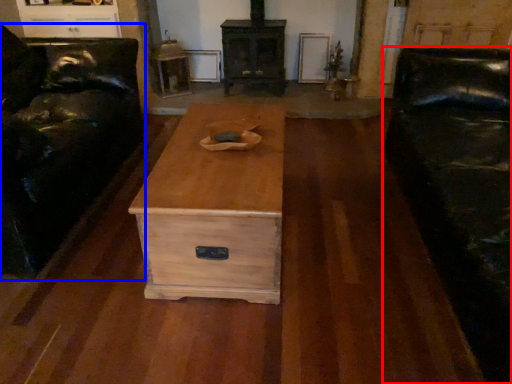
Question: Among these objects, which one is nearest to the camera, studio couch (highlighted by a red box) or furniture (highlighted by a blue box)?

Choices:
 (A) studio couch
 (B) furniture

Answer: (A)